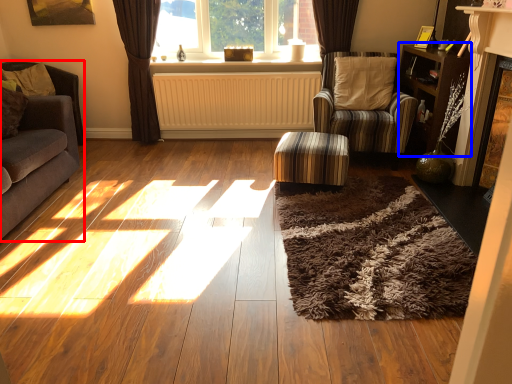
Question: Which object appears farthest to the camera in this image, studio couch (highlighted by a red box) or bookshelf (highlighted by a blue box)?

Choices:
 (A) studio couch
 (B) bookshelf

Answer: (B)